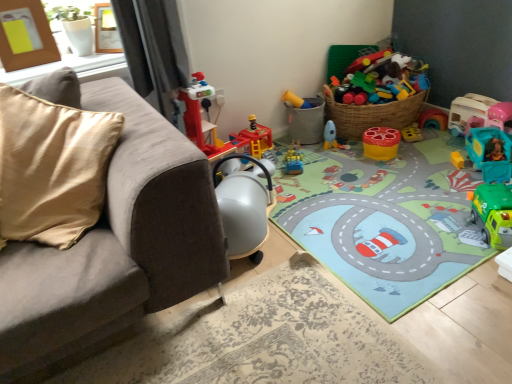
Find the location of a particular element. free area in between green plastic toy car at lower right, placed as the 3th toy when sorted from right to left, and shiny yellow plastic train at center, placed as the 6th toy when sorted from right to left is located at coordinates (379, 190).